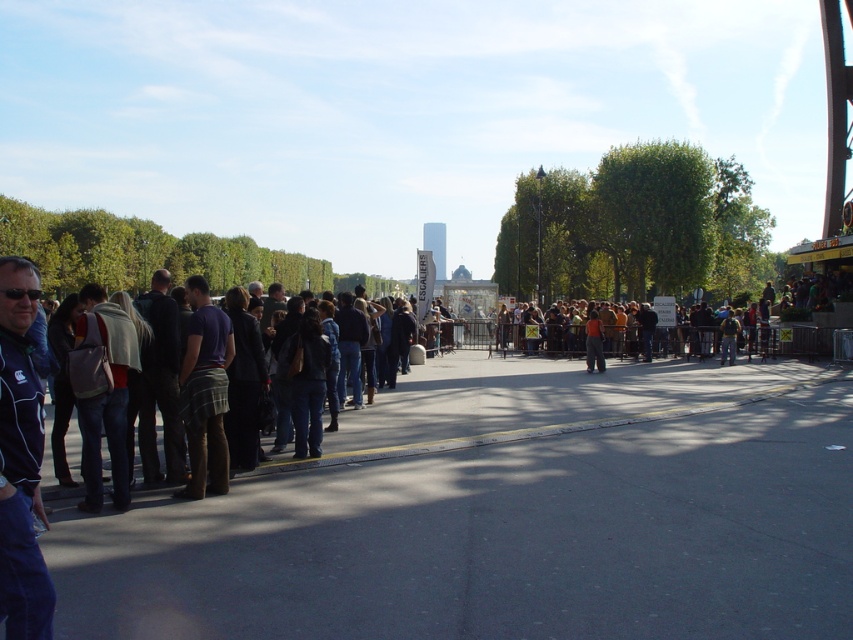
Is point (7, 545) more distant than point (720, 328)?

No.

Does blue fabric jacket at lower left have a greater width compared to denim jacket at center?

No.

Between point (28, 596) and point (733, 355), which one is positioned behind?

Point (733, 355)

Where is `blue fabric jacket at lower left`? blue fabric jacket at lower left is located at coordinates (20, 460).

Is point (186, 385) closer to camera compared to point (601, 321)?

Yes, point (186, 385) is closer to viewer.

Who is positioned more to the right, plaid fabric pants at center or orange cotton shirt at center?

From the viewer's perspective, orange cotton shirt at center appears more on the right side.

What do you see at coordinates (204, 392) in the screenshot? I see `plaid fabric pants at center` at bounding box center [204, 392].

Locate an element on the screen. plaid fabric pants at center is located at coordinates (204, 392).

Does orange cotton shirt at center have a smaller size compared to denim jacket at center?

No, orange cotton shirt at center is not smaller than denim jacket at center.

Can you confirm if orange cotton shirt at center is bigger than denim jacket at center?

Indeed, orange cotton shirt at center has a larger size compared to denim jacket at center.

In order to click on orange cotton shirt at center in this screenshot , I will do `click(595, 342)`.

At what (x,y) coordinates should I click in order to perform the action: click on orange cotton shirt at center. Please return your answer as a coordinate pair (x, y). Looking at the image, I should click on (595, 342).